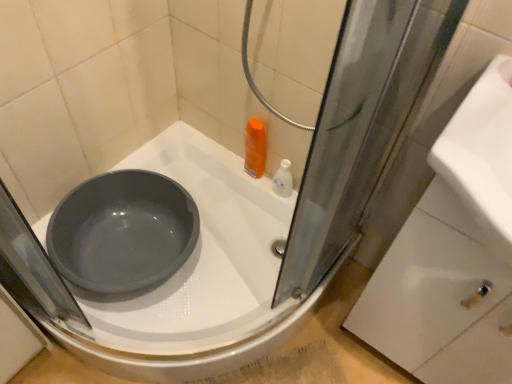
Question: Is matte gray basin at center in front of or behind white glossy drawer at lower right in the image?

Choices:
 (A) behind
 (B) front

Answer: (A)

Question: From the image's perspective, is matte gray basin at center located above or below white glossy drawer at lower right?

Choices:
 (A) below
 (B) above

Answer: (B)

Question: Which is nearer to the white glossy bottle at upper right?

Choices:
 (A) white glossy drawer at lower right
 (B) matte gray basin at center

Answer: (B)

Question: Which is farther from the white glossy drawer at lower right?

Choices:
 (A) matte gray basin at center
 (B) white glossy bottle at upper right

Answer: (B)